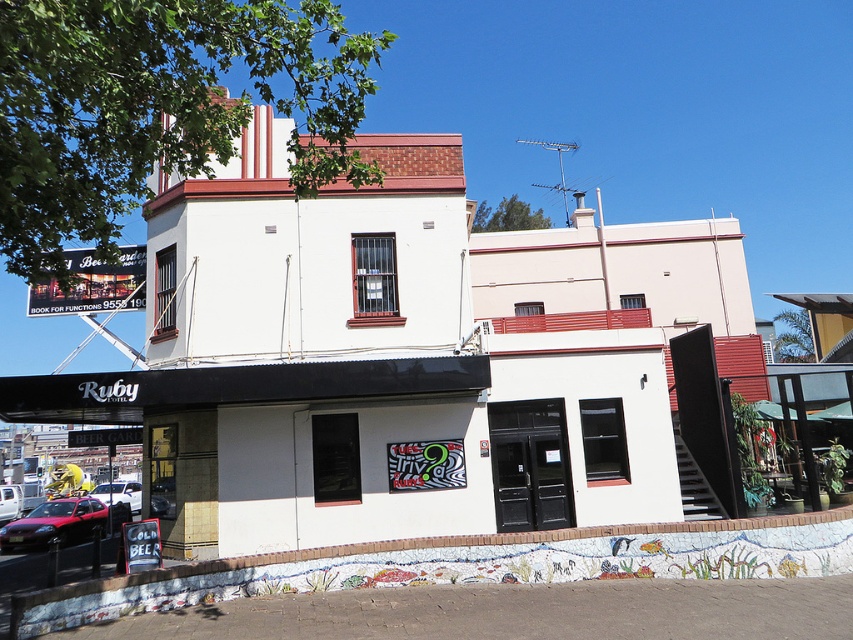
Question: Does matte red car at lower left have a lesser width compared to metallic red car at center?

Choices:
 (A) yes
 (B) no

Answer: (A)

Question: Does matte red car at lower left appear on the left side of metallic red car at center?

Choices:
 (A) yes
 (B) no

Answer: (B)

Question: Which object appears closest to the camera in this image?

Choices:
 (A) metallic red car at center
 (B) matte red car at lower left

Answer: (B)

Question: Does matte red car at lower left have a smaller size compared to metallic red car at center?

Choices:
 (A) no
 (B) yes

Answer: (B)